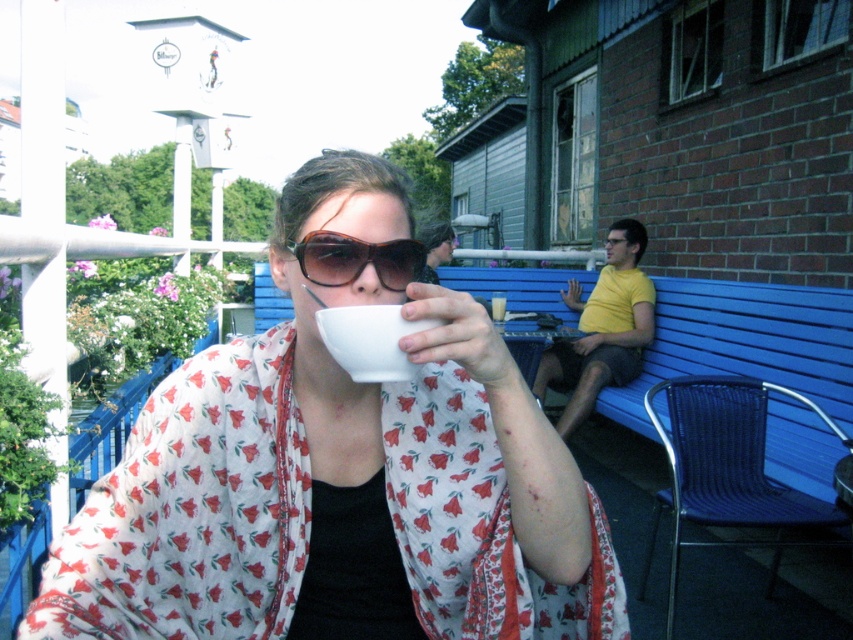
How much distance is there between white glossy mug at center and matte black sunglasses at center?

white glossy mug at center and matte black sunglasses at center are 18.81 centimeters apart from each other.

Consider the image. Does white glossy mug at center come behind matte black sunglasses at center?

No, white glossy mug at center is closer to the viewer.

Which is behind, point (213, 552) or point (316, 282)?

The point (213, 552) is behind.

The height and width of the screenshot is (640, 853). What are the coordinates of `white glossy mug at center` in the screenshot? It's located at (339, 477).